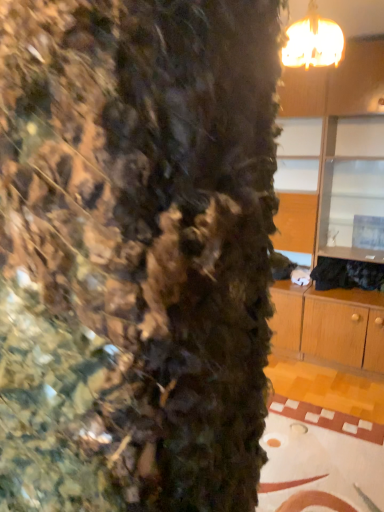
Question: From the image's perspective, is matte gold chandelier at upper right located above or below wooden cabinet at upper right?

Choices:
 (A) above
 (B) below

Answer: (A)

Question: Is matte gold chandelier at upper right inside the boundaries of wooden cabinet at upper right, or outside?

Choices:
 (A) outside
 (B) inside

Answer: (A)

Question: Is point (316, 31) positioned closer to the camera than point (342, 190)?

Choices:
 (A) closer
 (B) farther

Answer: (A)

Question: Considering their positions, is wooden cabinet at upper right located in front of or behind matte gold chandelier at upper right?

Choices:
 (A) front
 (B) behind

Answer: (B)

Question: Is point (294, 236) closer or farther from the camera than point (301, 61)?

Choices:
 (A) closer
 (B) farther

Answer: (B)

Question: Is wooden cabinet at upper right spatially inside matte gold chandelier at upper right, or outside of it?

Choices:
 (A) outside
 (B) inside

Answer: (A)

Question: From their relative heights in the image, would you say wooden cabinet at upper right is taller or shorter than matte gold chandelier at upper right?

Choices:
 (A) tall
 (B) short

Answer: (A)